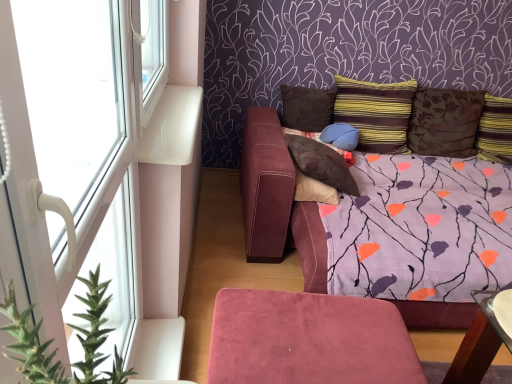
Question: Visually, is brown suede pillow at center, which is the sixth pillow from right to left, positioned to the left or to the right of striped fabric pillow at upper right, marked as the 1th pillow in a right-to-left arrangement?

Choices:
 (A) right
 (B) left

Answer: (B)

Question: Choose the correct answer: Is brown suede pillow at center, marked as the 1th pillow in a left-to-right arrangement, inside striped fabric pillow at upper right, marked as the 1th pillow in a right-to-left arrangement, or outside it?

Choices:
 (A) outside
 (B) inside

Answer: (A)

Question: Estimate the real-world distances between objects in this image. Which object is closer to the brown textured pillow at upper right, arranged as the fifth pillow when viewed from the left?

Choices:
 (A) matte blue pillow at center, which is counted as the fourth pillow, starting from the right
 (B) striped fabric pillow at upper center, positioned as the fourth pillow in left-to-right order
 (C) brown suede pillow at upper center, the 2th pillow positioned from the left
 (D) suede ottoman at lower center
 (E) green spiky plant at left

Answer: (B)

Question: Estimate the real-world distances between objects in this image. Which object is closer to the white plastic window at left, which is the first window in bottom-to-top order?

Choices:
 (A) brown suede pillow at center, which is the sixth pillow from right to left
 (B) striped fabric pillow at upper center, positioned as the fourth pillow in left-to-right order
 (C) striped fabric pillow at upper right, marked as the 1th pillow in a right-to-left arrangement
 (D) green spiky plant at left
 (E) white plastic window at upper left, which is the 2th window from bottom to top

Answer: (E)